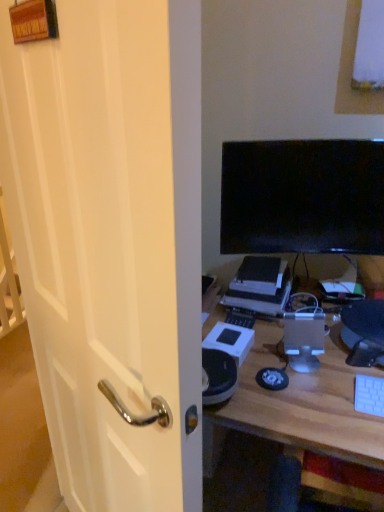
This screenshot has width=384, height=512. What do you see at coordinates (304, 333) in the screenshot?
I see `satin silver computer tower at center` at bounding box center [304, 333].

Describe the element at coordinates (260, 298) in the screenshot. I see `black plastic printer at center` at that location.

I want to click on black plastic printer at center, so click(260, 298).

Find the location of a particular element. The image size is (384, 512). white wood desk at center is located at coordinates click(x=299, y=405).

At what (x,y) coordinates should I click in order to perform the action: click on white glossy door handle at left. Please return your answer as a coordinate pair (x, y). Looking at the image, I should click on (97, 242).

Where is `satin silver computer tower at center`? satin silver computer tower at center is located at coordinates (304, 333).

Identify the location of glass door located above the white wood desk at center (from a real-world perspective). pos(97,242).

Is white glossy door handle at left touching white wood desk at center?

white glossy door handle at left and white wood desk at center are clearly separated.

How many degrees apart are the facing directions of white glossy door handle at left and white wood desk at center?

They differ by 30.5 degrees in their facing directions.

From a real-world perspective, between satin silver computer tower at center and black glossy screen at upper right, who is vertically higher?

black glossy screen at upper right is physically above.

Is satin silver computer tower at center beside black glossy screen at upper right?

No, satin silver computer tower at center is not next to black glossy screen at upper right.

From the image's perspective, is satin silver computer tower at center located beneath black glossy screen at upper right?

Yes.

From the image's perspective, is black plastic printer at center positioned above or below black glossy screen at upper right?

black plastic printer at center is below black glossy screen at upper right.

From a real-world perspective, who is located higher, black plastic printer at center or black glossy screen at upper right?

In real-world perspective, black glossy screen at upper right is above.

Who is taller, black plastic printer at center or black glossy screen at upper right?

black glossy screen at upper right.

Is the surface of black plastic printer at center in direct contact with black glossy screen at upper right?

No, black plastic printer at center is not touching black glossy screen at upper right.

Is point (369, 381) farther from camera compared to point (230, 298)?

No, it is in front of (230, 298).

Considering the positions of objects white plastic keyboard at lower right and black plastic printer at center in the image provided, who is more to the left, white plastic keyboard at lower right or black plastic printer at center?

black plastic printer at center is more to the left.

Locate an element on the screen. Image resolution: width=384 pixels, height=512 pixels. printer that is behind the white plastic keyboard at lower right is located at coordinates (260, 298).

Do you think white plastic keyboard at lower right is within black plastic printer at center, or outside of it?

white plastic keyboard at lower right cannot be found inside black plastic printer at center.

Is white wood desk at center aimed at black plastic printer at center?

No, white wood desk at center is not turned towards black plastic printer at center.

How distant is white wood desk at center from black plastic printer at center?

The distance of white wood desk at center from black plastic printer at center is 8.55 inches.

From a real-world perspective, is white wood desk at center above or below black plastic printer at center?

white wood desk at center is below black plastic printer at center.

Considering the relative positions of white wood desk at center and black plastic printer at center in the image provided, is white wood desk at center to the left of black plastic printer at center from the viewer's perspective?

No.

Where is `desk on the right of black glossy screen at upper right`? desk on the right of black glossy screen at upper right is located at coordinates (299, 405).

Is black glossy screen at upper right not inside white wood desk at center?

black glossy screen at upper right lies outside white wood desk at center's area.

Considering the sizes of black glossy screen at upper right and white wood desk at center in the image, is black glossy screen at upper right wider or thinner than white wood desk at center?

black glossy screen at upper right is thinner than white wood desk at center.

Does black glossy screen at upper right appear on the left side of white wood desk at center?

Correct, you'll find black glossy screen at upper right to the left of white wood desk at center.

From a real-world perspective, which is physically below, black plastic printer at center or white glossy door handle at left?

black plastic printer at center, from a real-world perspective.

Is black plastic printer at center further to the viewer compared to white glossy door handle at left?

Yes.

Locate an element on the screen. desk behind the white glossy door handle at left is located at coordinates (299, 405).

The image size is (384, 512). Identify the location of television on the right of satin silver computer tower at center. (302, 197).

When comparing their distances from white glossy door handle at left, does black glossy screen at upper right or white wood desk at center seem closer?

white wood desk at center lies closer to white glossy door handle at left than the other object.

Estimate the real-world distances between objects in this image. Which object is closer to white plastic keyboard at lower right, white glossy door handle at left or black glossy screen at upper right?

black glossy screen at upper right lies closer to white plastic keyboard at lower right than the other object.

In the scene shown: Which object lies nearer to the anchor point satin silver computer tower at center, white wood desk at center or black plastic printer at center?

Among the two, white wood desk at center is located nearer to satin silver computer tower at center.

Based on their spatial positions, is black glossy screen at upper right or satin silver computer tower at center further from white glossy door handle at left?

black glossy screen at upper right is positioned further to the anchor white glossy door handle at left.

Considering their positions, is white glossy door handle at left positioned further to white plastic keyboard at lower right than black plastic printer at center?

white glossy door handle at left.

Based on their spatial positions, is black plastic printer at center or satin silver computer tower at center closer to white wood desk at center?

Among the two, satin silver computer tower at center is located nearer to white wood desk at center.

Estimate the real-world distances between objects in this image. Which object is closer to black glossy screen at upper right, white wood desk at center or white glossy door handle at left?

Among the two, white wood desk at center is located nearer to black glossy screen at upper right.

Which object lies further to the anchor point black plastic printer at center, white wood desk at center or black glossy screen at upper right?

black glossy screen at upper right lies further to black plastic printer at center than the other object.

The width and height of the screenshot is (384, 512). Identify the location of computer tower between black plastic printer at center and white wood desk at center vertically. (304, 333).

Find the location of a particular element. computer keyboard between black glossy screen at upper right and white wood desk at center in the up-down direction is located at coordinates pyautogui.click(x=369, y=395).

This screenshot has height=512, width=384. In order to click on computer keyboard between white glossy door handle at left and black glossy screen at upper right in the front-back direction in this screenshot , I will do `click(369, 395)`.

This screenshot has height=512, width=384. What are the coordinates of `desk positioned between white glossy door handle at left and satin silver computer tower at center from near to far` in the screenshot? It's located at (299, 405).